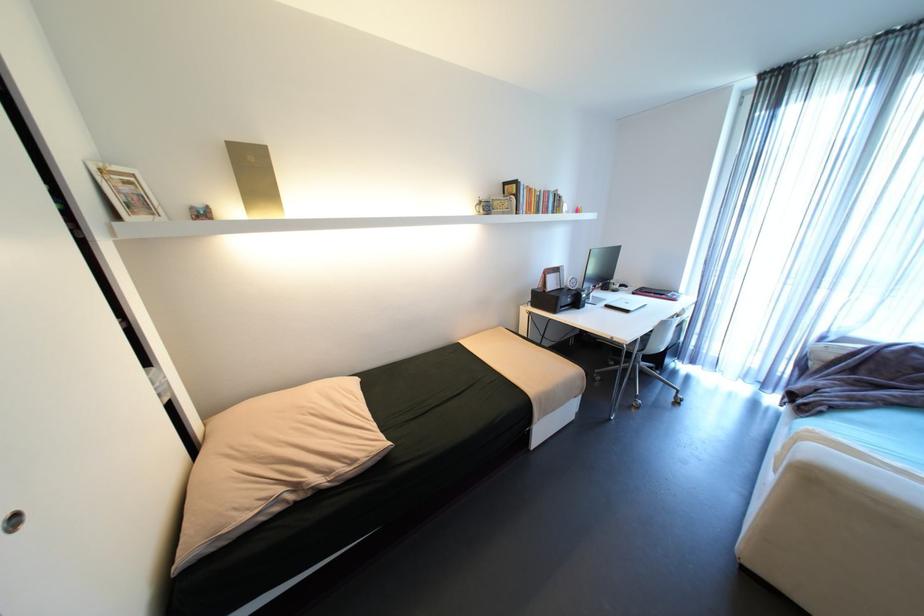
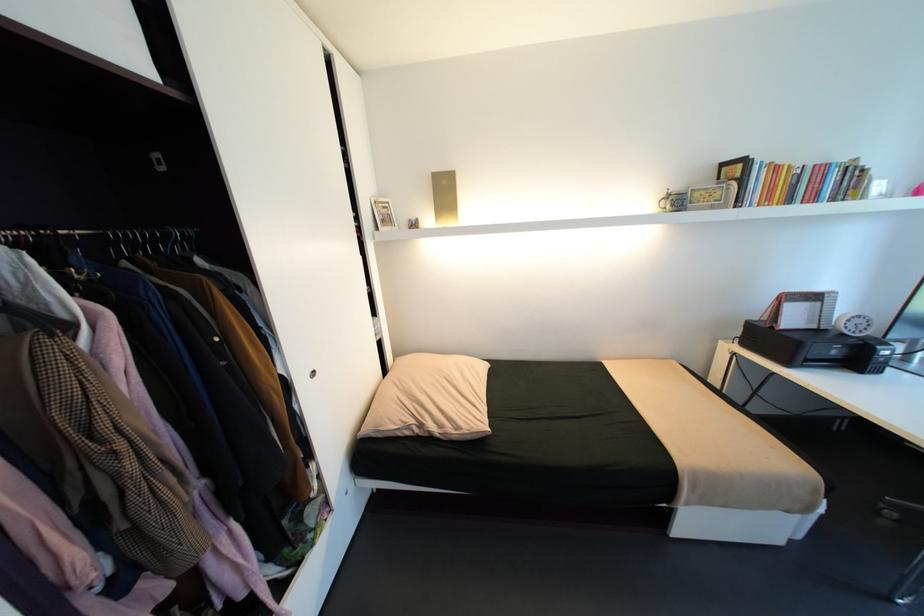
In the second image, find the point that corresponds to pixel 135 183 in the first image.

(392, 208)